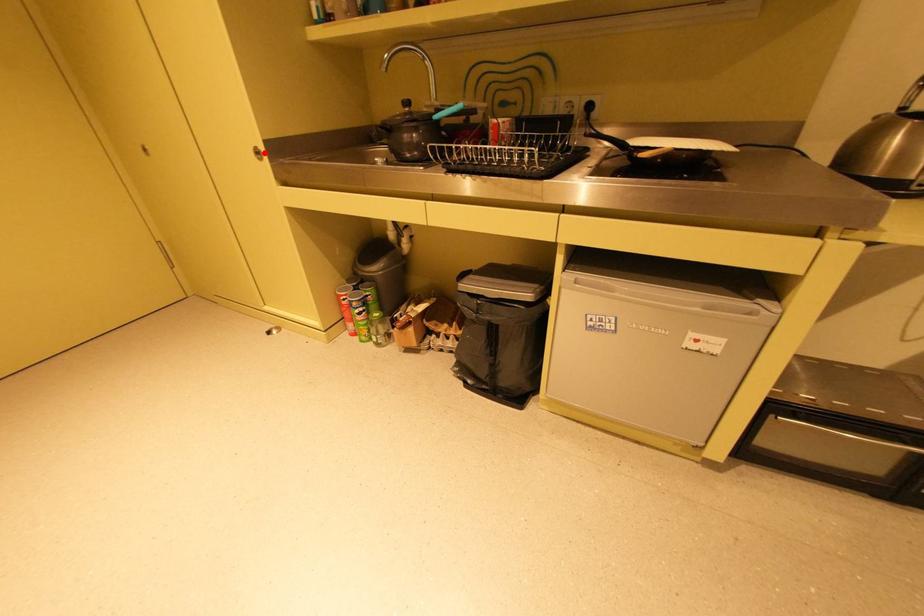
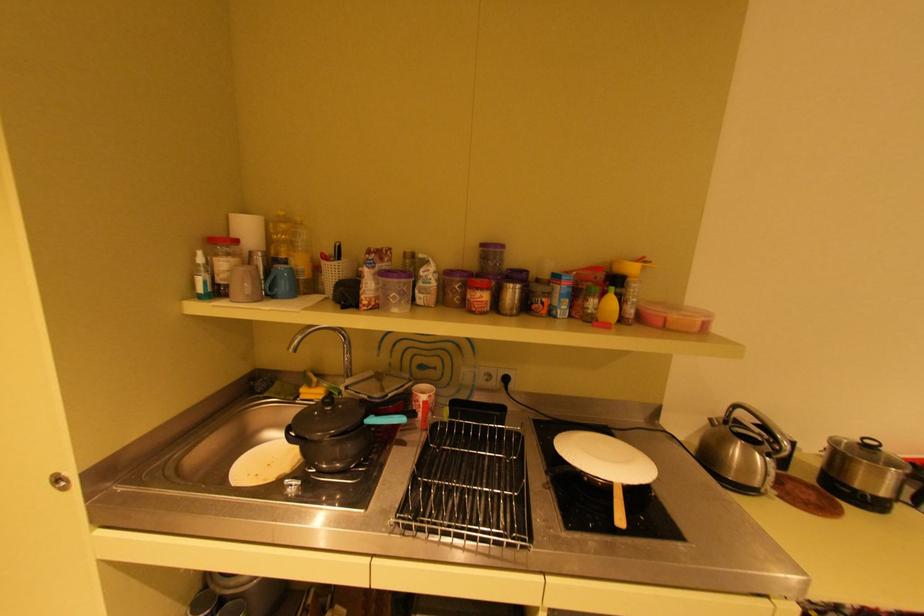
Question: A red point is marked in image1. In image2, is the corresponding 3D point closer to the camera or farther? Reply with the corresponding letter.

Choices:
 (A) The corresponding 3D point is closer.
 (B) The corresponding 3D point is farther.

Answer: (A)